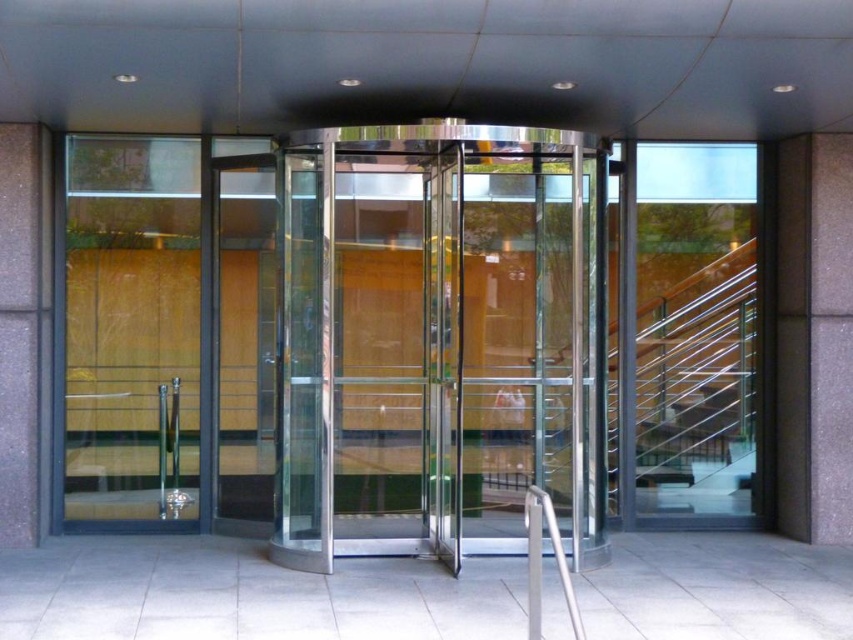
Is polished silver glass door at center behind silver metallic handrail at center?

Yes, polished silver glass door at center is further from the viewer.

Is polished silver glass door at center smaller than silver metallic handrail at center?

Incorrect, polished silver glass door at center is not smaller in size than silver metallic handrail at center.

Which is behind, point (523, 237) or point (535, 605)?

The point (523, 237) is behind.

At what (x,y) coordinates should I click in order to perform the action: click on polished silver glass door at center. Please return your answer as a coordinate pair (x, y). This screenshot has height=640, width=853. Looking at the image, I should click on (439, 340).